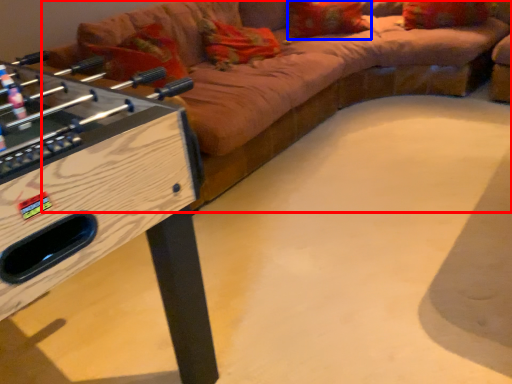
Question: Which object is further to the camera taking this photo, studio couch (highlighted by a red box) or pillow (highlighted by a blue box)?

Choices:
 (A) studio couch
 (B) pillow

Answer: (B)